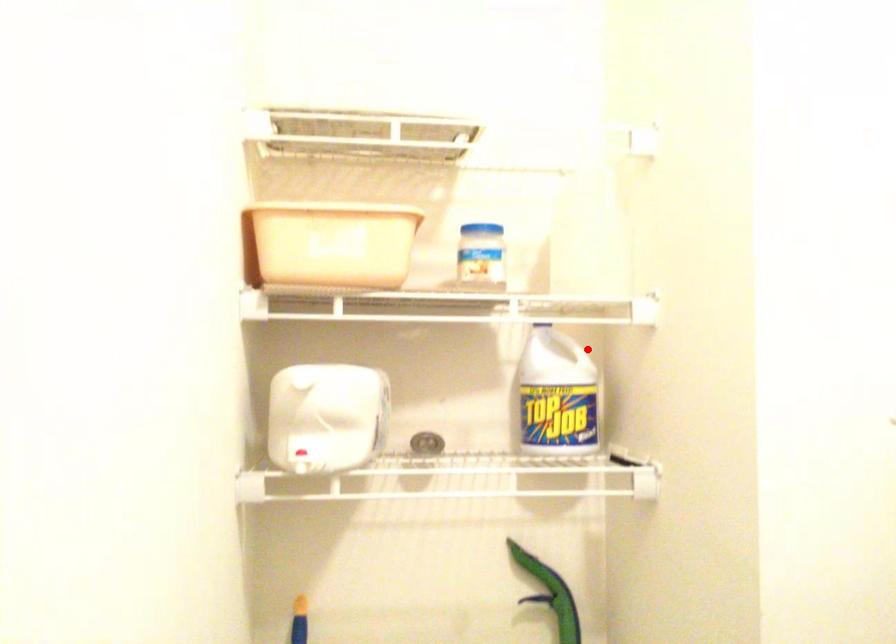
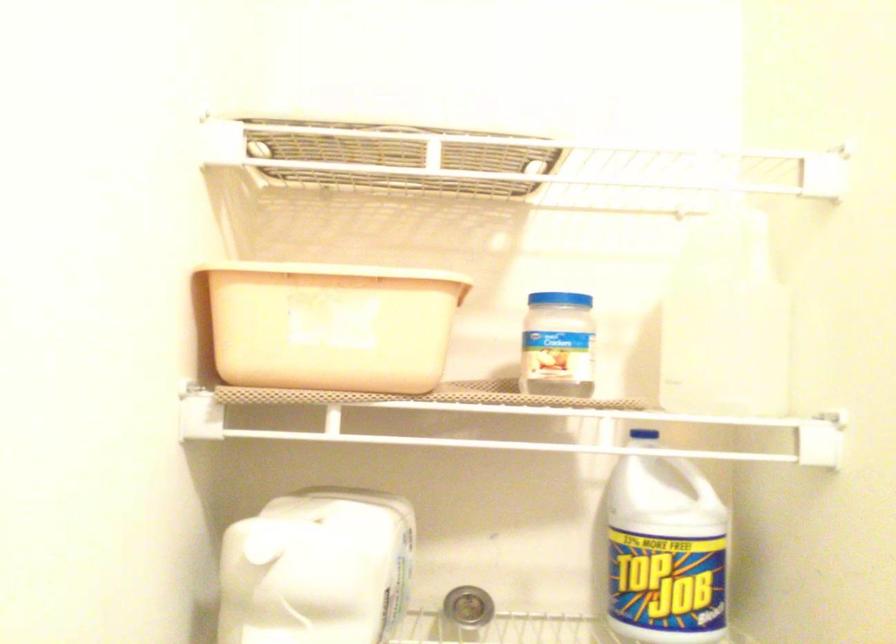
Question: I am providing you with two images of the same scene from different viewpoints. Image1 has a red point marked. In image2, the corresponding 3D location appears at what relative position? Reply with the corresponding letter.

Choices:
 (A) Closer
 (B) Farther

Answer: (A)